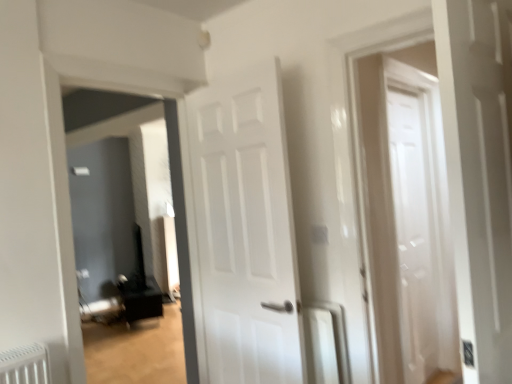
Measure the distance between white glossy radiator at center and camera.

The distance of white glossy radiator at center from camera is 6.45 feet.

Locate an element on the screen. The image size is (512, 384). white glossy radiator at center is located at coordinates (325, 343).

You are a GUI agent. You are given a task and a screenshot of the screen. Output one action in this format:
    pyautogui.click(x=<x>, y=<y>)
    Task: Click on the white glossy door at center
    
    Given the screenshot: What is the action you would take?
    pyautogui.click(x=244, y=231)

From the image's perspective, is white glossy radiator at center beneath white glossy door at center?

Indeed, from the image's perspective, white glossy radiator at center is shown beneath white glossy door at center.

This screenshot has width=512, height=384. Find the location of `door on the left of white glossy radiator at center`. door on the left of white glossy radiator at center is located at coordinates point(244,231).

Would you say white glossy door at center is part of white glossy radiator at center's contents?

No, white glossy door at center is not surrounded by white glossy radiator at center.

Is white glossy radiator at center positioned far away from white glossy door at center?

No, white glossy radiator at center is in close proximity to white glossy door at center.

Between white glossy door at center and matte black speaker at left, which one is positioned behind?

matte black speaker at left.

Is white glossy door at center in contact with matte black speaker at left?

No.

Is white glossy door at center surrounding matte black speaker at left?

No, matte black speaker at left is not surrounded by white glossy door at center.

From a real-world perspective, which object stands above the other?

matte black speaker at left is physically above.

Image resolution: width=512 pixels, height=384 pixels. In order to click on corridor on the left of white glossy radiator at center in this screenshot , I will do `click(181, 235)`.

From the image's perspective, which one is positioned higher, matte black speaker at left or white glossy radiator at center?

matte black speaker at left.

Considering the relative sizes of matte black speaker at left and white glossy radiator at center in the image provided, is matte black speaker at left wider than white glossy radiator at center?

Correct, the width of matte black speaker at left exceeds that of white glossy radiator at center.

Considering the relative sizes of matte black speaker at left and white glossy door at center in the image provided, is matte black speaker at left smaller than white glossy door at center?

No, matte black speaker at left is not smaller than white glossy door at center.

From the picture: Is matte black speaker at left aimed at white glossy door at center?

No, matte black speaker at left is not oriented towards white glossy door at center.

From the image's perspective, which one is positioned higher, matte black speaker at left or white glossy door at center?

From the image's view, white glossy door at center is above.

Looking at this image, is white glossy radiator at center surrounded by white glossy door at center?

No.

Looking at this image, is white glossy door at center bigger or smaller than white glossy radiator at center?

In the image, white glossy door at center appears to be larger than white glossy radiator at center.

Is white glossy door at center positioned with its back to white glossy radiator at center?

Yes.

Measure the distance from white glossy door at center to white glossy radiator at center.

white glossy door at center and white glossy radiator at center are 17.99 inches apart.

Does white glossy radiator at center appear on the left side of matte black speaker at left?

No.

Is point (313, 322) closer or farther from the camera than point (162, 107)?

Point (313, 322) appears to be closer to the viewer than point (162, 107).

Does white glossy radiator at center turn towards matte black speaker at left?

No, white glossy radiator at center is not aimed at matte black speaker at left.

Can you confirm if white glossy radiator at center is smaller than matte black speaker at left?

Indeed, white glossy radiator at center has a smaller size compared to matte black speaker at left.

Identify the location of radiator located behind the white glossy door at center. The height and width of the screenshot is (384, 512). (325, 343).

The width and height of the screenshot is (512, 384). Find the location of `corridor below the white glossy door at center (from a real-world perspective)`. corridor below the white glossy door at center (from a real-world perspective) is located at coordinates (181, 235).

Estimate the real-world distances between objects in this image. Which object is further from white glossy door at center, matte black speaker at left or white glossy radiator at center?

matte black speaker at left is further to white glossy door at center.

When comparing their distances from white glossy radiator at center, does matte black speaker at left or white glossy door at center seem further?

matte black speaker at left is further to white glossy radiator at center.

From the image, which object appears to be farther from white glossy radiator at center, white glossy door at center or matte black speaker at left?

Based on the image, matte black speaker at left appears to be further to white glossy radiator at center.

Considering their positions, is white glossy door at center positioned closer to matte black speaker at left than white glossy radiator at center?

white glossy door at center is closer to matte black speaker at left.

Based on their spatial positions, is white glossy radiator at center or white glossy door at center closer to matte black speaker at left?

white glossy door at center.

In the scene shown: Considering their positions, is white glossy radiator at center positioned further to white glossy door at center than matte black speaker at left?

matte black speaker at left.

Find the location of a particular element. door located between matte black speaker at left and white glossy radiator at center in the left-right direction is located at coordinates (244, 231).